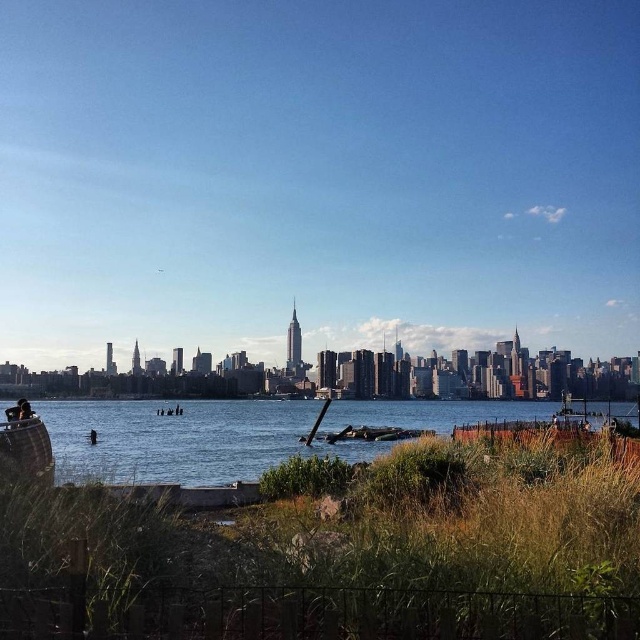
Who is lower down, clear blue water at lower center or wooden boat at lower left?

wooden boat at lower left is below.

Does clear blue water at lower center have a smaller size compared to wooden boat at lower left?

Incorrect, clear blue water at lower center is not smaller in size than wooden boat at lower left.

In order to click on clear blue water at lower center in this screenshot , I will do `click(184, 440)`.